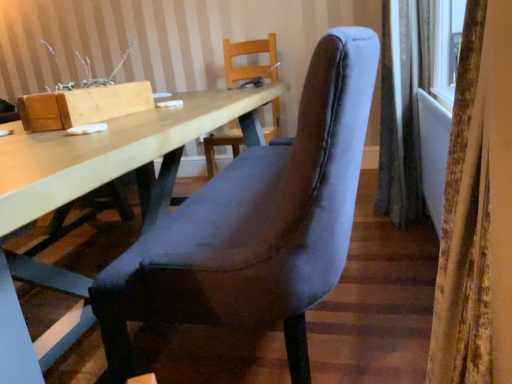
Question: Is velvet grey chair at center wider or thinner than gray fabric curtain at right, the second curtain from the front?

Choices:
 (A) thin
 (B) wide

Answer: (B)

Question: From a real-world perspective, is velvet grey chair at center positioned above or below gray fabric curtain at right, the second curtain from the front?

Choices:
 (A) above
 (B) below

Answer: (B)

Question: Estimate the real-world distances between objects in this image. Which object is closer to the velvet curtain at right, the 1th curtain viewed from the front?

Choices:
 (A) gray fabric curtain at right, which ranks as the 2th curtain in left-to-right order
 (B) light wood table at center
 (C) velvet grey chair at center

Answer: (C)

Question: Which of these objects is positioned farthest from the gray fabric curtain at right, which ranks as the 2th curtain in left-to-right order?

Choices:
 (A) velvet grey chair at center
 (B) velvet curtain at right, which is the 1th curtain from left to right
 (C) light wood table at center

Answer: (B)